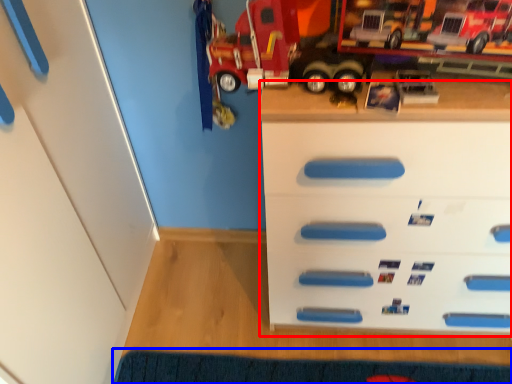
Question: Which point is further to the camera, chest of drawers (highlighted by a red box) or doormat (highlighted by a blue box)?

Choices:
 (A) chest of drawers
 (B) doormat

Answer: (B)